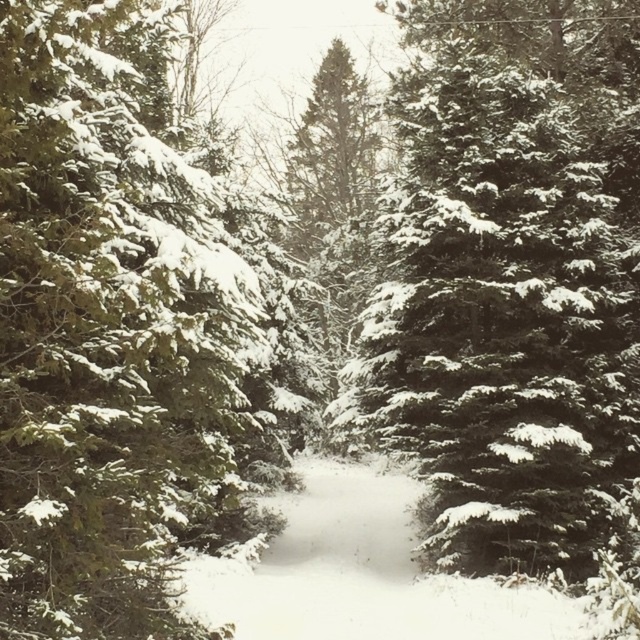
Based on the photo, you are standing at the center of the path in the winter forest scene. Which direction should you walk to reach the green matte evergreen tree at left?

You should walk to the left because the green matte evergreen tree at left is located at point (108,333), which is to the left of the center path.